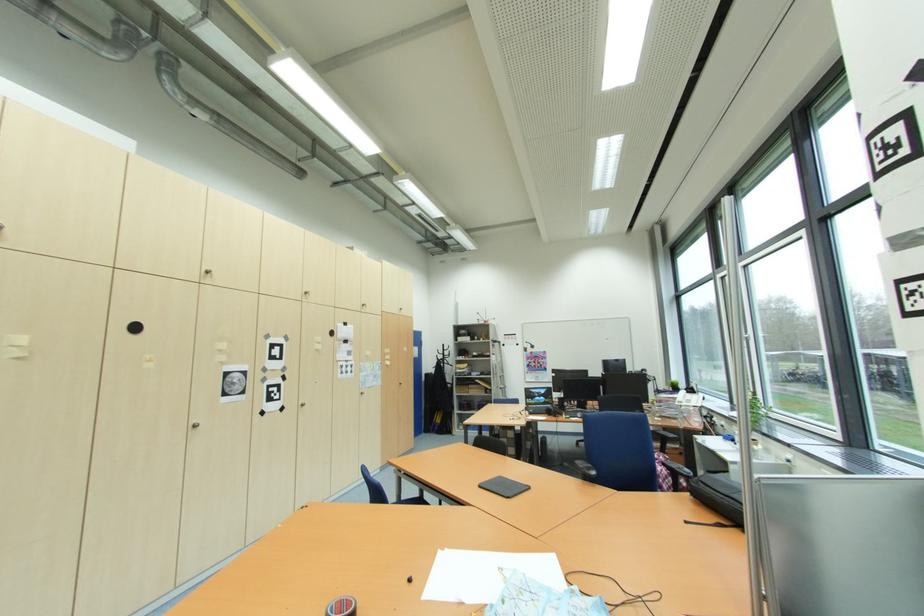
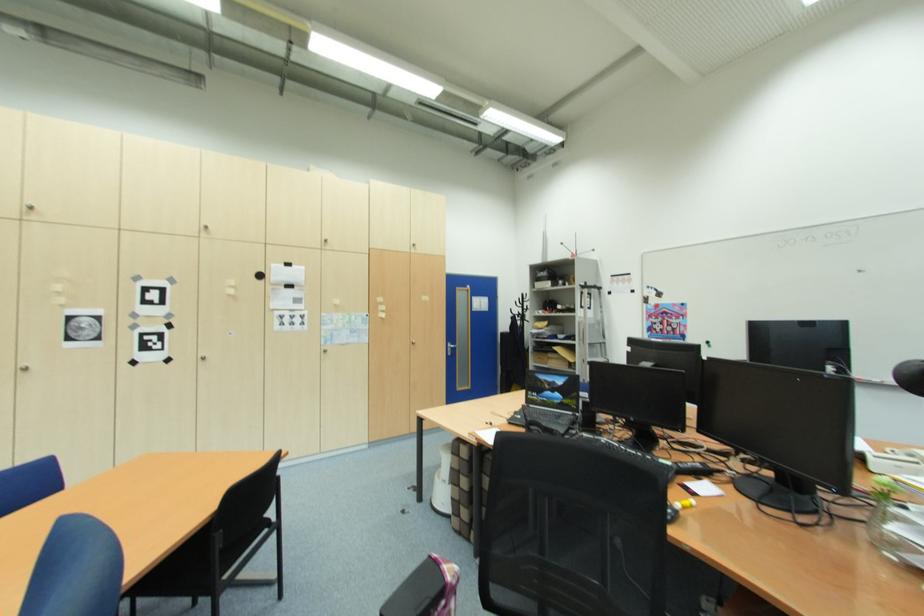
Where in the second image is the point corresponding to (x=308, y=406) from the first image?

(208, 360)